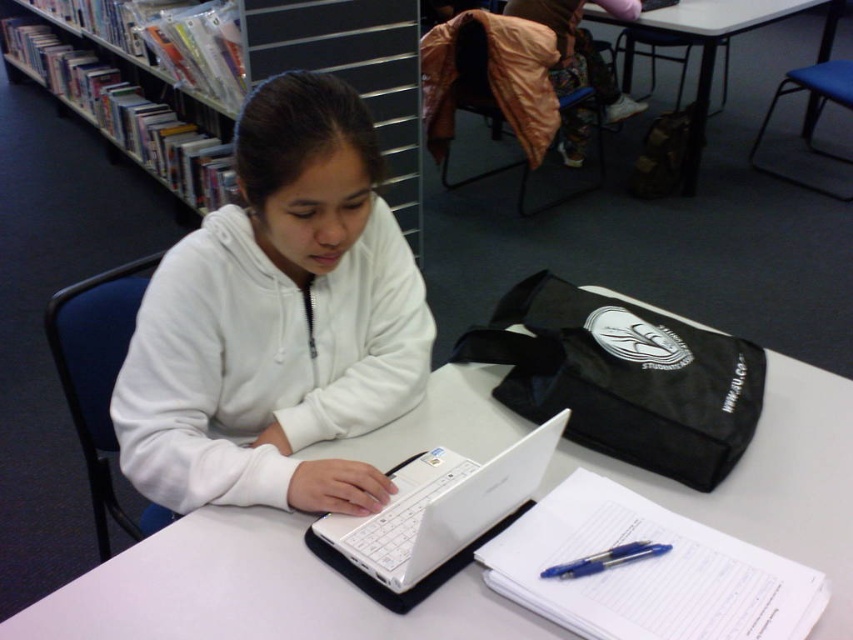
You are trying to place a book on the table. The book is wider than the white plastic laptop at center. Can the book fit on the white plastic table at center if placed next to the laptop?

The white plastic table at center is to the right of the white plastic laptop at center, but the description does not provide information about the table size or the laptop dimensions. Therefore, it is impossible to determine if the book will fit based on the given information.

You are a student who just arrived at the library and need to place your white fleece jacket at center on the white plastic table at center. The jacket is 12 inches wide. Can it fit on the table?

The white fleece jacket at center is 9.66 inches from the white plastic table at center, so there is enough space for the jacket to be placed on the table since the distance between them is less than the jacket width.